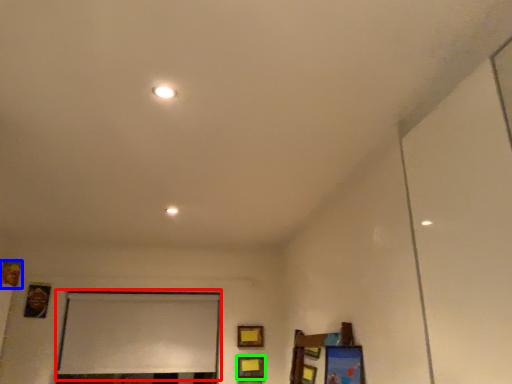
Question: Which is nearer to the window screen (highlighted by a red box)? picture frame (highlighted by a blue box) or picture frame (highlighted by a green box).

Choices:
 (A) picture frame
 (B) picture frame

Answer: (B)